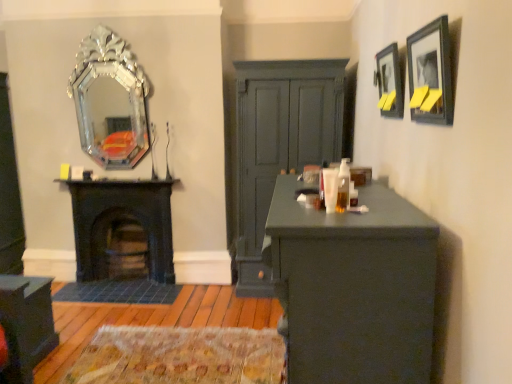
What do you see at coordinates (354, 288) in the screenshot?
I see `matte dark green desk at center` at bounding box center [354, 288].

Find the location of a particular element. matte dark green desk at center is located at coordinates (354, 288).

You are a GUI agent. You are given a task and a screenshot of the screen. Output one action in this format:
    pyautogui.click(x=<x>, y=<y>)
    Task: Click on the matte black picture frame at upper right, which appears as the 2th picture frame when viewed from the back
    This screenshot has height=384, width=512.
    Given the screenshot: What is the action you would take?
    pyautogui.click(x=430, y=74)

This screenshot has width=512, height=384. What do you see at coordinates (389, 82) in the screenshot?
I see `matte black picture frame at upper right, placed as the first picture frame when sorted from back to front` at bounding box center [389, 82].

You are a GUI agent. You are given a task and a screenshot of the screen. Output one action in this format:
    pyautogui.click(x=<x>, y=<y>)
    Task: Click on the silver metallic mirror at upper left
    The width and height of the screenshot is (512, 384).
    Given the screenshot: What is the action you would take?
    tap(111, 100)

Where is `matte black cabinet at lower left`? The width and height of the screenshot is (512, 384). matte black cabinet at lower left is located at coordinates (26, 325).

Locate an element on the screen. Image resolution: width=512 pixels, height=384 pixels. matte dark green desk at center is located at coordinates (354, 288).

Is black cast iron fireplace at left in front of matte black picture frame at upper right, which appears as the 2th picture frame when viewed from the front?

No, black cast iron fireplace at left is further to the viewer.

Looking at this image, considering the positions of objects black cast iron fireplace at left and matte black picture frame at upper right, which appears as the 2th picture frame when viewed from the front, in the image provided, who is more to the right, black cast iron fireplace at left or matte black picture frame at upper right, which appears as the 2th picture frame when viewed from the front,?

matte black picture frame at upper right, which appears as the 2th picture frame when viewed from the front.

From a real-world perspective, is black cast iron fireplace at left located higher than matte black picture frame at upper right, placed as the first picture frame when sorted from back to front?

No, from a real-world perspective, black cast iron fireplace at left is not over matte black picture frame at upper right, placed as the first picture frame when sorted from back to front

Measure the distance from matte black cabinet at lower left to matte dark green dresser at center.

matte black cabinet at lower left and matte dark green dresser at center are 1.78 meters apart.

From a real-world perspective, is matte black cabinet at lower left positioned over matte dark green dresser at center based on gravity?

No.

Considering the relative sizes of matte black cabinet at lower left and matte dark green dresser at center in the image provided, is matte black cabinet at lower left wider than matte dark green dresser at center?

No.

Is point (17, 285) farther from viewer compared to point (300, 117)?

No, it is in front of (300, 117).

The width and height of the screenshot is (512, 384). Identify the location of mirror behind the matte black picture frame at upper right, placed as the first picture frame when sorted from back to front. (111, 100).

Considering the sizes of silver metallic mirror at upper left and matte black picture frame at upper right, placed as the first picture frame when sorted from back to front, in the image, is silver metallic mirror at upper left bigger or smaller than matte black picture frame at upper right, placed as the first picture frame when sorted from back to front,?

In the image, silver metallic mirror at upper left appears to be larger than matte black picture frame at upper right, placed as the first picture frame when sorted from back to front.

Does silver metallic mirror at upper left turn towards matte black picture frame at upper right, placed as the first picture frame when sorted from back to front?

No, silver metallic mirror at upper left is not facing towards matte black picture frame at upper right, placed as the first picture frame when sorted from back to front.

Considering the positions of objects silver metallic mirror at upper left and matte black picture frame at upper right, placed as the first picture frame when sorted from back to front, in the image provided, who is in front, silver metallic mirror at upper left or matte black picture frame at upper right, placed as the first picture frame when sorted from back to front,?

matte black picture frame at upper right, placed as the first picture frame when sorted from back to front, is in front.

Is silver metallic mirror at upper left a part of matte black cabinet at lower left?

No, silver metallic mirror at upper left is not surrounded by matte black cabinet at lower left.

Considering the sizes of matte black cabinet at lower left and silver metallic mirror at upper left in the image, is matte black cabinet at lower left bigger or smaller than silver metallic mirror at upper left?

Considering their sizes, matte black cabinet at lower left takes up more space than silver metallic mirror at upper left.

Looking at this image, which object is closer to the camera taking this photo, matte black cabinet at lower left or silver metallic mirror at upper left?

matte black cabinet at lower left.

How far apart are matte black cabinet at lower left and silver metallic mirror at upper left?

A distance of 1.62 meters exists between matte black cabinet at lower left and silver metallic mirror at upper left.

Can you tell me how much matte black cabinet at lower left and matte dark green desk at center differ in facing direction?

The angular difference between matte black cabinet at lower left and matte dark green desk at center is 90.2 degrees.

Considering the relative sizes of matte black cabinet at lower left and matte dark green desk at center in the image provided, is matte black cabinet at lower left smaller than matte dark green desk at center?

Indeed, matte black cabinet at lower left has a smaller size compared to matte dark green desk at center.

Is matte black cabinet at lower left beside matte dark green desk at center?

No.

Is matte black cabinet at lower left far away from matte black picture frame at upper right, the 1th picture frame in the front-to-back sequence?

That's right, there is a large distance between matte black cabinet at lower left and matte black picture frame at upper right, the 1th picture frame in the front-to-back sequence.

Locate an element on the screen. This screenshot has width=512, height=384. picture frame that is the 1st one above the matte black cabinet at lower left (from a real-world perspective) is located at coordinates (430, 74).

Considering the sizes of objects matte black cabinet at lower left and matte black picture frame at upper right, which appears as the 2th picture frame when viewed from the back, in the image provided, who is smaller, matte black cabinet at lower left or matte black picture frame at upper right, which appears as the 2th picture frame when viewed from the back,?

Smaller between the two is matte black picture frame at upper right, which appears as the 2th picture frame when viewed from the back.

From the image's perspective, is matte black cabinet at lower left on matte black picture frame at upper right, the 1th picture frame in the front-to-back sequence?

Actually, matte black cabinet at lower left appears below matte black picture frame at upper right, the 1th picture frame in the front-to-back sequence, in the image.

Is black cast iron fireplace at left smaller than silver metallic mirror at upper left?

Incorrect, black cast iron fireplace at left is not smaller in size than silver metallic mirror at upper left.

Where is `mirror on the left of black cast iron fireplace at left`? The height and width of the screenshot is (384, 512). mirror on the left of black cast iron fireplace at left is located at coordinates pyautogui.click(x=111, y=100).

Considering the points (76, 209) and (99, 79), which point is behind, point (76, 209) or point (99, 79)?

Positioned behind is point (76, 209).

The width and height of the screenshot is (512, 384). Identify the location of picture frame that is the 2nd one when counting upward from the black cast iron fireplace at left (from the image's perspective). (389, 82).

Locate an element on the screen. This screenshot has width=512, height=384. cabinetry below the matte dark green dresser at center (from a real-world perspective) is located at coordinates (26, 325).

From the image, which object appears to be farther from matte black cabinet at lower left, matte dark green dresser at center or black cast iron fireplace at left?

matte dark green dresser at center is further to matte black cabinet at lower left.

Considering their positions, is matte dark green desk at center positioned closer to matte black picture frame at upper right, which appears as the 2th picture frame when viewed from the back, than matte dark green dresser at center?

Based on the image, matte dark green desk at center appears to be nearer to matte black picture frame at upper right, which appears as the 2th picture frame when viewed from the back.

Estimate the real-world distances between objects in this image. Which object is further from matte black picture frame at upper right, which appears as the 2th picture frame when viewed from the front, matte dark green dresser at center or silver metallic mirror at upper left?

Based on the image, silver metallic mirror at upper left appears to be further to matte black picture frame at upper right, which appears as the 2th picture frame when viewed from the front.

Based on their spatial positions, is matte black picture frame at upper right, which appears as the 2th picture frame when viewed from the front, or matte dark green dresser at center closer to silver metallic mirror at upper left?

The object closer to silver metallic mirror at upper left is matte dark green dresser at center.

Looking at the image, which one is located closer to matte dark green desk at center, matte black picture frame at upper right, placed as the first picture frame when sorted from back to front, or matte black cabinet at lower left?

Among the two, matte black picture frame at upper right, placed as the first picture frame when sorted from back to front, is located nearer to matte dark green desk at center.

From the image, which object appears to be farther from matte black picture frame at upper right, placed as the first picture frame when sorted from back to front, matte black cabinet at lower left or matte black picture frame at upper right, the 1th picture frame in the front-to-back sequence?

matte black cabinet at lower left is positioned further to the anchor matte black picture frame at upper right, placed as the first picture frame when sorted from back to front.

Which object lies further to the anchor point matte dark green desk at center, silver metallic mirror at upper left or matte dark green dresser at center?

silver metallic mirror at upper left is positioned further to the anchor matte dark green desk at center.

From the image, which object appears to be farther from matte black picture frame at upper right, placed as the first picture frame when sorted from back to front, matte dark green desk at center or silver metallic mirror at upper left?

silver metallic mirror at upper left is further to matte black picture frame at upper right, placed as the first picture frame when sorted from back to front.

Image resolution: width=512 pixels, height=384 pixels. I want to click on mirror between matte black cabinet at lower left and matte dark green dresser at center, so click(111, 100).

Identify the location of mirror between matte dark green desk at center and black cast iron fireplace at left in the front-back direction. (111, 100).

Locate an element on the screen. The height and width of the screenshot is (384, 512). fireplace between matte black cabinet at lower left and matte black picture frame at upper right, placed as the first picture frame when sorted from back to front, from left to right is located at coordinates (121, 224).

This screenshot has height=384, width=512. What are the coordinates of `fireplace between silver metallic mirror at upper left and matte black cabinet at lower left in the vertical direction` in the screenshot? It's located at (121, 224).